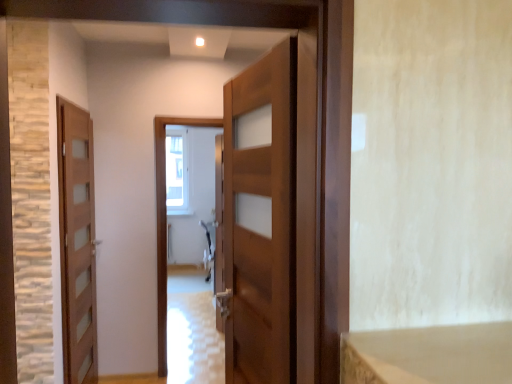
Question: Is wooden door at left, which ranks as the first door in left-to-right order, inside or outside of clear glass window at center?

Choices:
 (A) outside
 (B) inside

Answer: (A)

Question: From a real-world perspective, is wooden door at left, which is the 2th door in front-to-back order, positioned above or below clear glass window at center?

Choices:
 (A) below
 (B) above

Answer: (A)

Question: Based on their relative distances, which object is farther from the wooden door at left, marked as the first door in a back-to-front arrangement?

Choices:
 (A) clear glass window at center
 (B) wooden door at center, positioned as the first door in right-to-left order
 (C) glossy wooden door at center

Answer: (A)

Question: Which of these objects is positioned closest to the glossy wooden door at center?

Choices:
 (A) clear glass window at center
 (B) wooden door at left, acting as the 2th door starting from the right
 (C) wooden door at center, positioned as the first door in right-to-left order

Answer: (B)